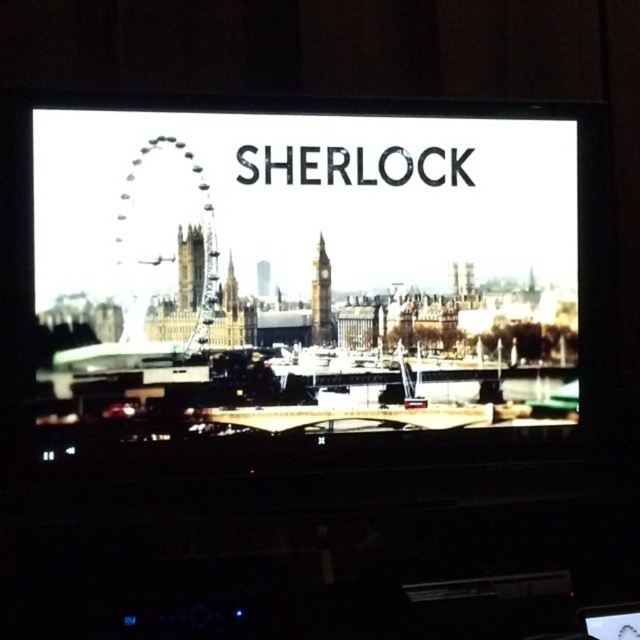
Which is more to the right, matte black screen at center or stone clock tower at center?

Positioned to the right is stone clock tower at center.

Which is behind, point (403, 150) or point (330, 273)?

The point (403, 150) is behind.

Find the location of `matte black screen at center`. matte black screen at center is located at coordinates (308, 260).